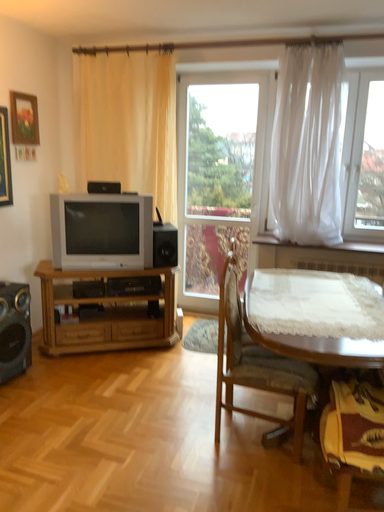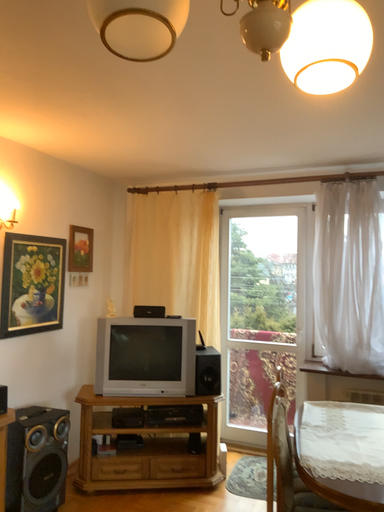
Question: Which way did the camera rotate in the video?

Choices:
 (A) rotated upward
 (B) rotated downward

Answer: (A)